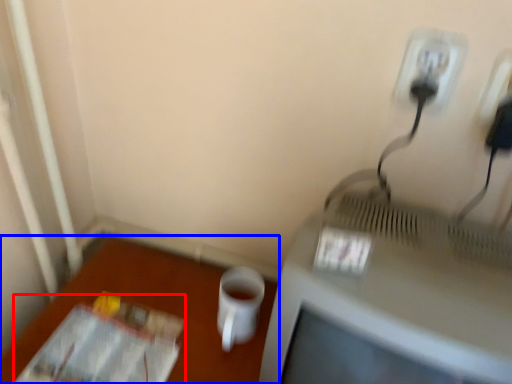
Question: Among these objects, which one is farthest to the camera, magazine (highlighted by a red box) or table (highlighted by a blue box)?

Choices:
 (A) magazine
 (B) table

Answer: (B)